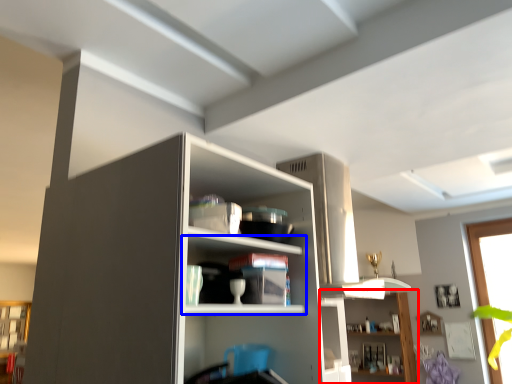
Question: Which object appears closest to the camera in this image, shelf (highlighted by a red box) or shelf (highlighted by a blue box)?

Choices:
 (A) shelf
 (B) shelf

Answer: (B)